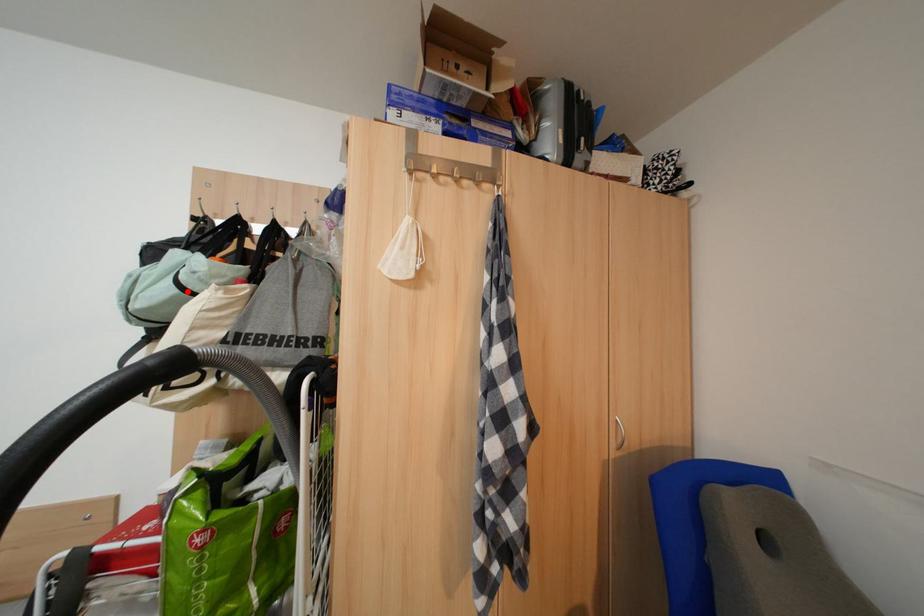
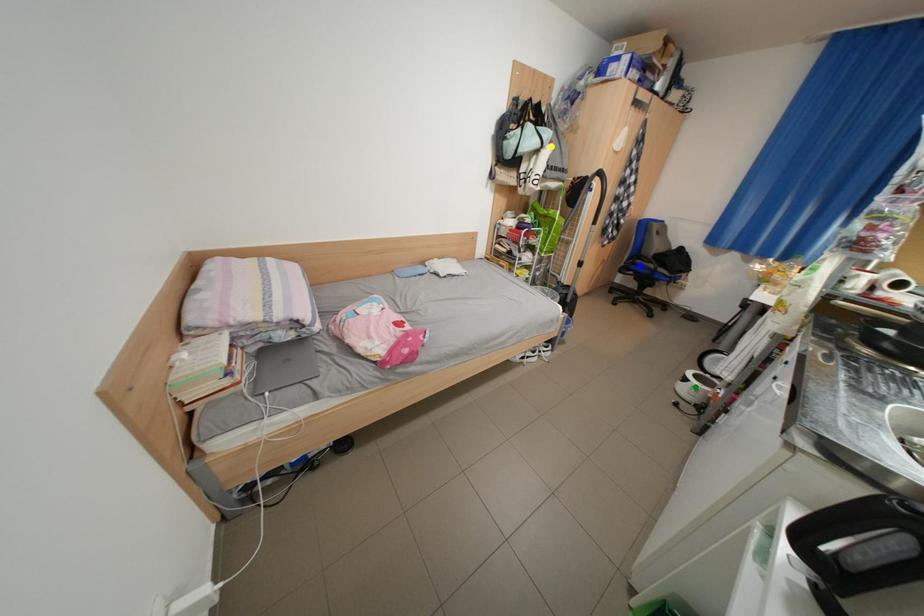
Question: I am providing you with two images of the same scene from different viewpoints. A red point is marked on the first image. You are given multiple points on the second image. Which spot in image 2 lines up with the point in image 1?

Choices:
 (A) green point
 (B) yellow point
 (C) blue point

Answer: (B)